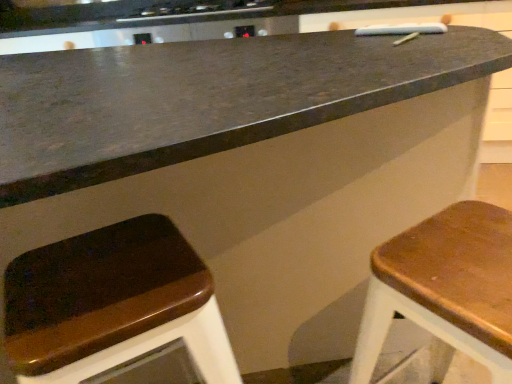
Question: Does black glass stove at upper center have a lesser width compared to wooden seat at lower left, the 2th stool positioned from the right?

Choices:
 (A) no
 (B) yes

Answer: (A)

Question: Can wooden seat at lower left, the 1th stool viewed from the left, be found inside black glass stove at upper center?

Choices:
 (A) yes
 (B) no

Answer: (B)

Question: From a real-world perspective, is black glass stove at upper center physically below wooden seat at lower left, the 2th stool positioned from the right?

Choices:
 (A) yes
 (B) no

Answer: (B)

Question: Could you tell me if black glass stove at upper center is turned towards wooden seat at lower left, the 2th stool positioned from the right?

Choices:
 (A) yes
 (B) no

Answer: (B)

Question: Is black glass stove at upper center to the left of wooden seat at lower left, the 1th stool viewed from the left, from the viewer's perspective?

Choices:
 (A) no
 (B) yes

Answer: (B)

Question: From the image's perspective, is black glass stove at upper center above or below wooden seat at lower left, the 1th stool viewed from the left?

Choices:
 (A) below
 (B) above

Answer: (B)

Question: In terms of height, does black glass stove at upper center look taller or shorter compared to wooden seat at lower left, the 2th stool positioned from the right?

Choices:
 (A) short
 (B) tall

Answer: (A)

Question: Based on their positions, is black glass stove at upper center located to the left or right of wooden seat at lower left, the 1th stool viewed from the left?

Choices:
 (A) right
 (B) left

Answer: (B)

Question: In the image, is black glass stove at upper center positioned in front of or behind wooden seat at lower left, the 2th stool positioned from the right?

Choices:
 (A) front
 (B) behind

Answer: (B)

Question: Is wooden seat at lower left, the 1th stool viewed from the left, wider or thinner than black glass stove at upper center?

Choices:
 (A) wide
 (B) thin

Answer: (B)

Question: Is wooden seat at lower left, the 1th stool viewed from the left, to the left or to the right of black glass stove at upper center in the image?

Choices:
 (A) right
 (B) left

Answer: (A)

Question: From a real-world perspective, is wooden seat at lower left, the 1th stool viewed from the left, above or below black glass stove at upper center?

Choices:
 (A) below
 (B) above

Answer: (A)

Question: In terms of height, does wooden seat at lower left, the 2th stool positioned from the right, look taller or shorter compared to black glass stove at upper center?

Choices:
 (A) short
 (B) tall

Answer: (B)

Question: Is point (232, 6) positioned closer to the camera than point (503, 332)?

Choices:
 (A) closer
 (B) farther

Answer: (B)

Question: Is black glass stove at upper center in front of or behind wooden seat at right, the 2th stool positioned from the left, in the image?

Choices:
 (A) front
 (B) behind

Answer: (B)